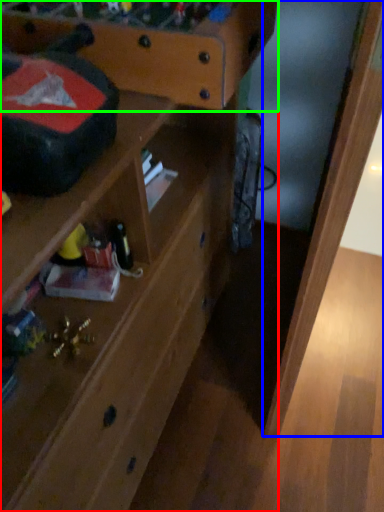
Question: Which object is the closest to the shelf (highlighted by a red box)? Choose among these: wood (highlighted by a blue box) or writing desk (highlighted by a green box).

Choices:
 (A) wood
 (B) writing desk

Answer: (B)